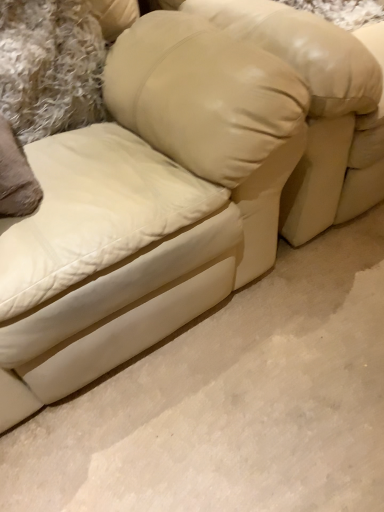
Question: Does beige leather pillow at upper center have a smaller size compared to beige leather bean bag chair at center?

Choices:
 (A) no
 (B) yes

Answer: (B)

Question: Considering the relative sizes of beige leather pillow at upper center and beige leather bean bag chair at center in the image provided, is beige leather pillow at upper center wider than beige leather bean bag chair at center?

Choices:
 (A) no
 (B) yes

Answer: (A)

Question: Is beige leather pillow at upper center far away from beige leather bean bag chair at center?

Choices:
 (A) yes
 (B) no

Answer: (B)

Question: Is beige leather bean bag chair at center located within beige leather pillow at upper center?

Choices:
 (A) no
 (B) yes

Answer: (A)

Question: Does beige leather pillow at upper center come in front of beige leather bean bag chair at center?

Choices:
 (A) yes
 (B) no

Answer: (B)

Question: Can we say beige leather pillow at upper center lies outside beige leather bean bag chair at center?

Choices:
 (A) no
 (B) yes

Answer: (B)

Question: From a real-world perspective, is beige leather bean bag chair at center below beige leather pillow at upper center?

Choices:
 (A) yes
 (B) no

Answer: (A)

Question: Is beige leather bean bag chair at center in front of beige leather pillow at upper center?

Choices:
 (A) yes
 (B) no

Answer: (A)

Question: Considering the relative sizes of beige leather bean bag chair at center and beige leather pillow at upper center in the image provided, is beige leather bean bag chair at center taller than beige leather pillow at upper center?

Choices:
 (A) yes
 (B) no

Answer: (A)

Question: Is beige leather bean bag chair at center shorter than beige leather pillow at upper center?

Choices:
 (A) no
 (B) yes

Answer: (A)

Question: Is beige leather bean bag chair at center facing away from beige leather pillow at upper center?

Choices:
 (A) no
 (B) yes

Answer: (A)

Question: Considering the relative positions of beige leather bean bag chair at center and beige leather pillow at upper center in the image provided, is beige leather bean bag chair at center to the left of beige leather pillow at upper center from the viewer's perspective?

Choices:
 (A) yes
 (B) no

Answer: (B)

Question: Is point (36, 124) positioned closer to the camera than point (377, 78)?

Choices:
 (A) closer
 (B) farther

Answer: (B)